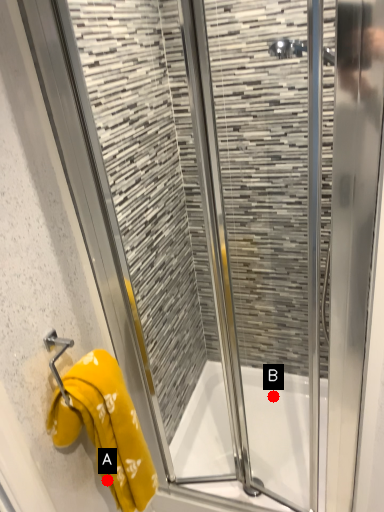
Question: Two points are circled on the image, labeled by A and B beside each circle. Which of the following is the farthest from the observer?

Choices:
 (A) A is further
 (B) B is further

Answer: (B)